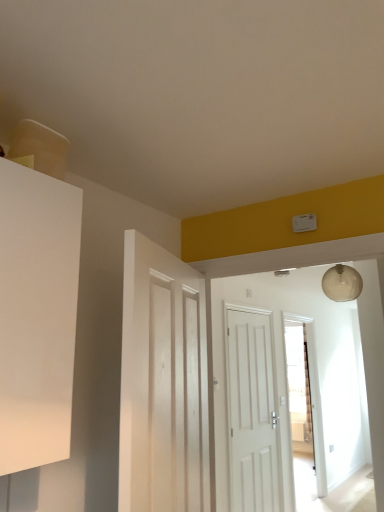
Question: Which direction should I rotate to look at white matte door at center, the 2th door positioned from the front, — up or down?

Choices:
 (A) down
 (B) up

Answer: (A)

Question: Is the depth of transparent glass door at center greater than that of white matte door at center, which ranks as the 1th door in back-to-front order?

Choices:
 (A) yes
 (B) no

Answer: (A)

Question: From a real-world perspective, is transparent glass door at center located higher than white matte door at center, which ranks as the 1th door in back-to-front order?

Choices:
 (A) yes
 (B) no

Answer: (B)

Question: Can you confirm if transparent glass door at center is positioned to the right of white matte door at center, the first door when ordered from right to left?

Choices:
 (A) no
 (B) yes

Answer: (B)

Question: Considering the relative sizes of transparent glass door at center and white matte door at center, the first door when ordered from right to left, in the image provided, is transparent glass door at center bigger than white matte door at center, the first door when ordered from right to left,?

Choices:
 (A) yes
 (B) no

Answer: (A)

Question: Considering the relative sizes of transparent glass door at center and white matte door at center, the 2th door positioned from the front, in the image provided, is transparent glass door at center shorter than white matte door at center, the 2th door positioned from the front,?

Choices:
 (A) no
 (B) yes

Answer: (A)

Question: Is white matte door at center, which is counted as the 2th door, starting from the left, at the back of transparent glass door at center?

Choices:
 (A) no
 (B) yes

Answer: (A)

Question: From a real-world perspective, is white matte door at center, which is counted as the 2th door, starting from the left, under transparent glass door at center?

Choices:
 (A) yes
 (B) no

Answer: (B)

Question: Could you tell me if white matte door at center, the 2th door positioned from the front, is turned towards transparent glass door at center?

Choices:
 (A) no
 (B) yes

Answer: (A)

Question: Is white matte door at center, the 2th door positioned from the front, smaller than transparent glass door at center?

Choices:
 (A) yes
 (B) no

Answer: (A)

Question: From the image's perspective, would you say white matte door at center, which is counted as the 2th door, starting from the left, is shown under transparent glass door at center?

Choices:
 (A) yes
 (B) no

Answer: (B)

Question: Can you confirm if white matte door at center, which is counted as the 2th door, starting from the left, is shorter than transparent glass door at center?

Choices:
 (A) no
 (B) yes

Answer: (B)

Question: From the image's perspective, is white matte door at center, the first door when ordered from right to left, located above transparent glass door at center?

Choices:
 (A) no
 (B) yes

Answer: (B)

Question: From a real-world perspective, is white wooden door at center, which is counted as the second door, starting from the right, located higher than transparent glass door at center?

Choices:
 (A) yes
 (B) no

Answer: (A)